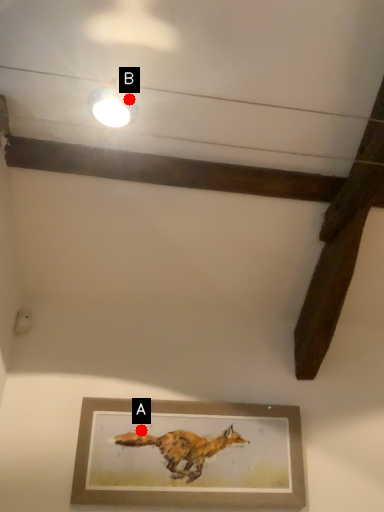
Question: Two points are circled on the image, labeled by A and B beside each circle. Which point is further to the camera?

Choices:
 (A) A is further
 (B) B is further

Answer: (A)